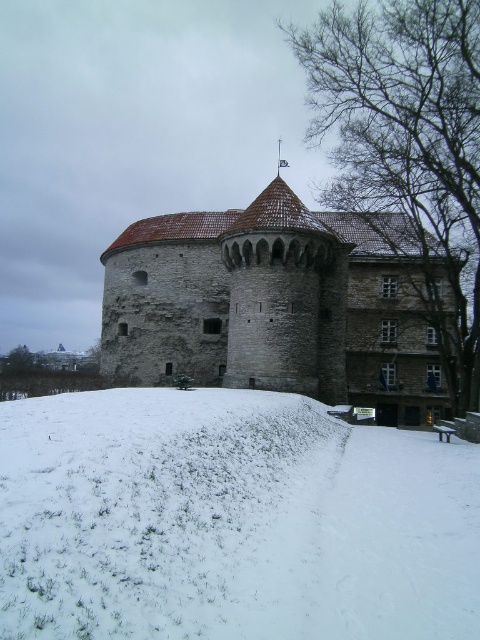
You are a delivery drone with a maximum flight range of 25 meters. You need to deliver a package from the white fluffy snow at lower center to the stone tower at center. Can you complete the delivery without needing a recharge?

The distance between the white fluffy snow at lower center and the stone tower at center is 27.25 meters, which exceeds the drone s 25 meter range. Therefore, the drone cannot complete the delivery without recharging.

You are an architect visiting this historic site. You need to determine if you can place a 2m tall model of the stone tower at center on the white fluffy snow at lower center without it being too large for the space. Can you do this?

The white fluffy snow at lower center is smaller than the stone tower at center. Since the model is 2m tall, which matches the original tower, but the snow area is smaller, it may not have enough space. Check the snow area dimensions first.

You are standing in front of the historic stone building and want to place a small decorative snowman exactly where the white fluffy snow at lower center is located. According to the coordinates provided, can you determine the exact position to place it?

The white fluffy snow at lower center is located at coordinates point (x=230, y=522), so you should place the snowman at that exact position.